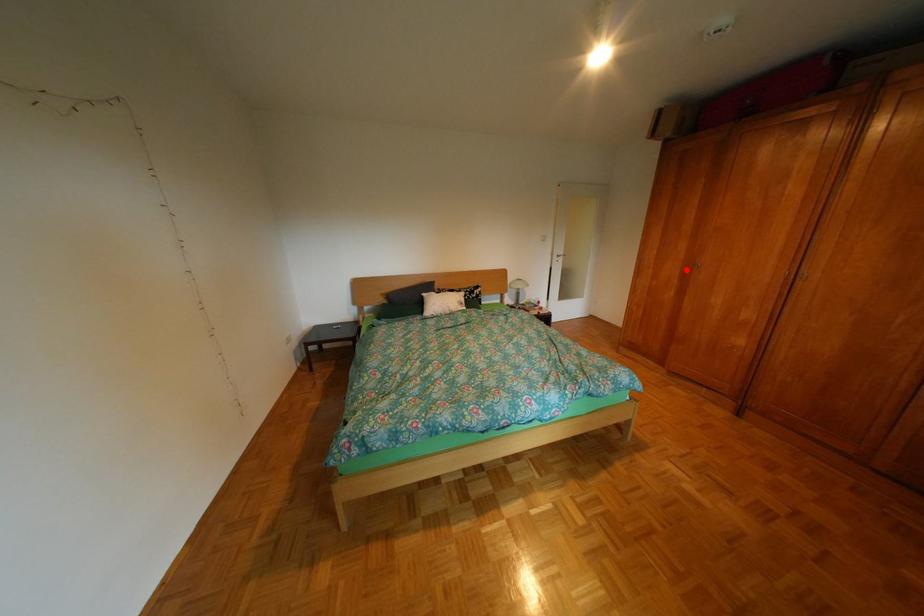
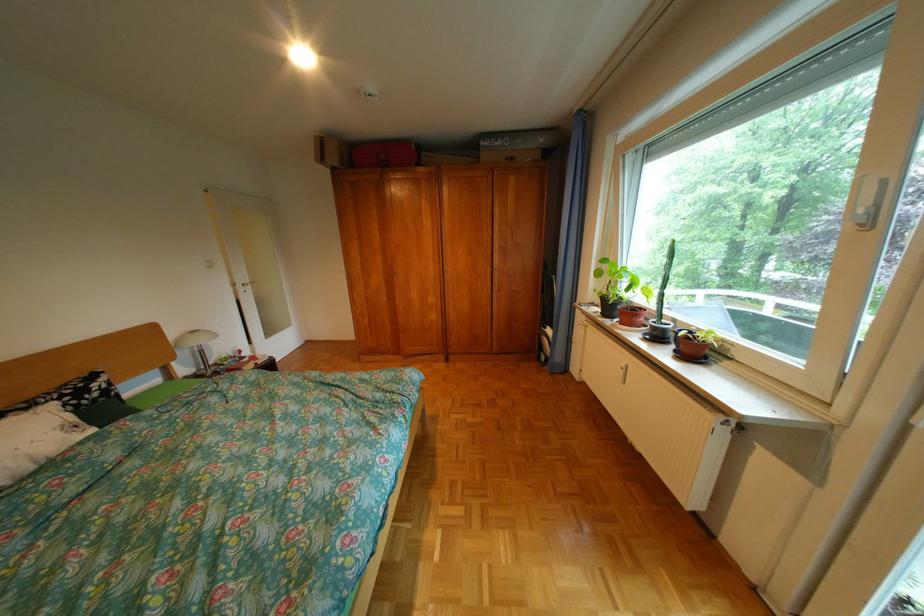
Where in the second image is the point corresponding to the highlighted location from the first image?

(392, 280)